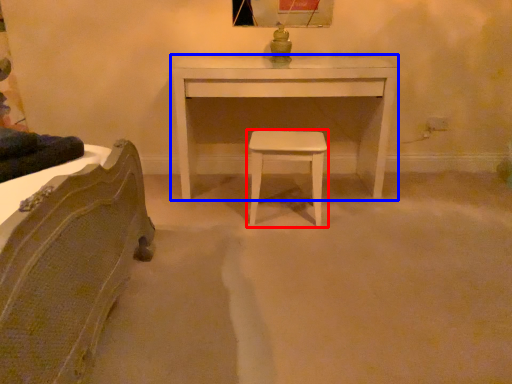
Question: Which object appears farthest to the camera in this image, stool (highlighted by a red box) or table (highlighted by a blue box)?

Choices:
 (A) stool
 (B) table

Answer: (B)